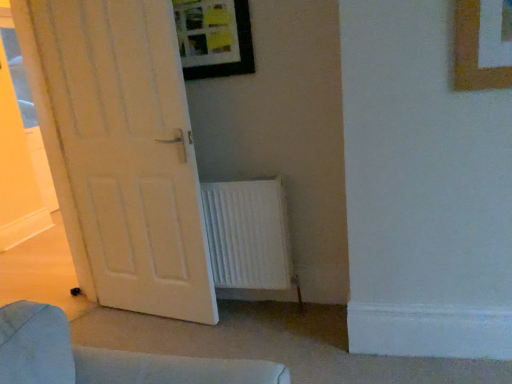
Question: Are white matte door at left and wooden-framed picture at upper center making contact?

Choices:
 (A) no
 (B) yes

Answer: (A)

Question: From the image's perspective, is white matte door at left on top of wooden-framed picture at upper center?

Choices:
 (A) yes
 (B) no

Answer: (B)

Question: Is the position of white matte door at left less distant than that of wooden-framed picture at upper center?

Choices:
 (A) no
 (B) yes

Answer: (B)

Question: Is white matte door at left far from wooden-framed picture at upper center?

Choices:
 (A) yes
 (B) no

Answer: (B)

Question: Would you say white matte door at left contains wooden-framed picture at upper center?

Choices:
 (A) yes
 (B) no

Answer: (B)

Question: Is white matte door at left smaller than wooden-framed picture at upper center?

Choices:
 (A) no
 (B) yes

Answer: (A)

Question: Can you confirm if wooden-framed picture at upper center is shorter than white matte door at left?

Choices:
 (A) yes
 (B) no

Answer: (A)

Question: Could you tell me if wooden-framed picture at upper center is turned towards white matte door at left?

Choices:
 (A) yes
 (B) no

Answer: (B)

Question: From the image's perspective, is wooden-framed picture at upper center on white matte door at left?

Choices:
 (A) no
 (B) yes

Answer: (B)

Question: Is wooden-framed picture at upper center facing away from white matte door at left?

Choices:
 (A) yes
 (B) no

Answer: (B)

Question: Does wooden-framed picture at upper center appear on the right side of white matte door at left?

Choices:
 (A) no
 (B) yes

Answer: (B)

Question: Considering the relative sizes of wooden-framed picture at upper center and white matte door at left in the image provided, is wooden-framed picture at upper center bigger than white matte door at left?

Choices:
 (A) no
 (B) yes

Answer: (A)

Question: Is white textured radiator at lower center smaller than white matte door at left?

Choices:
 (A) no
 (B) yes

Answer: (B)